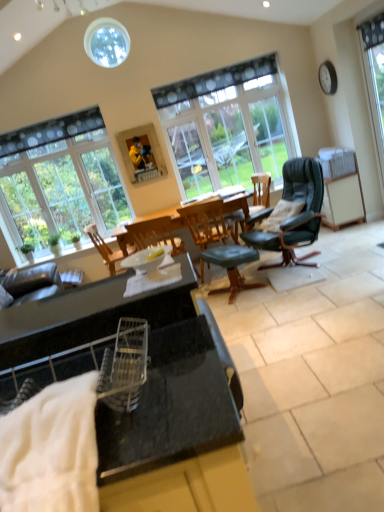
Identify the location of vacant space to the right of green leather stool at center. The height and width of the screenshot is (512, 384). (276, 273).